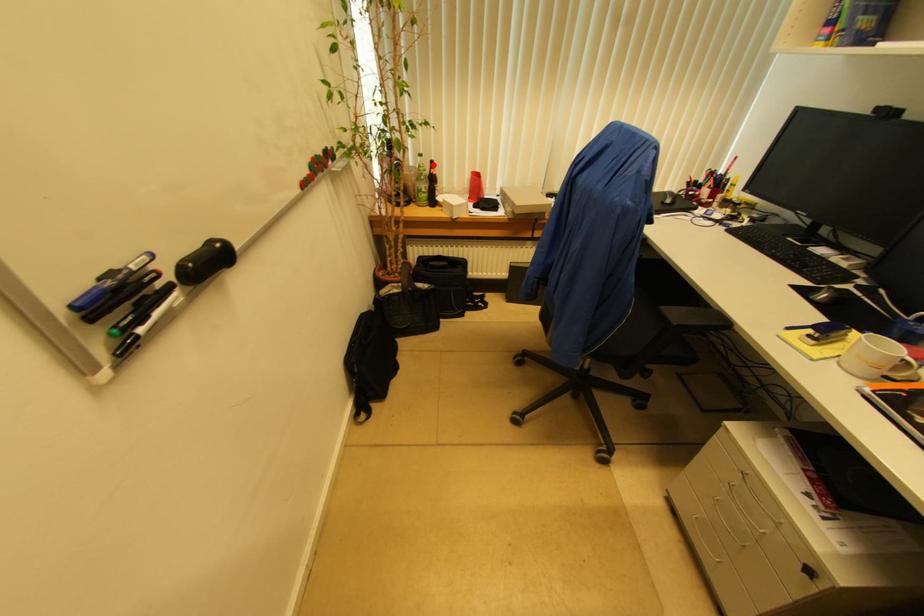
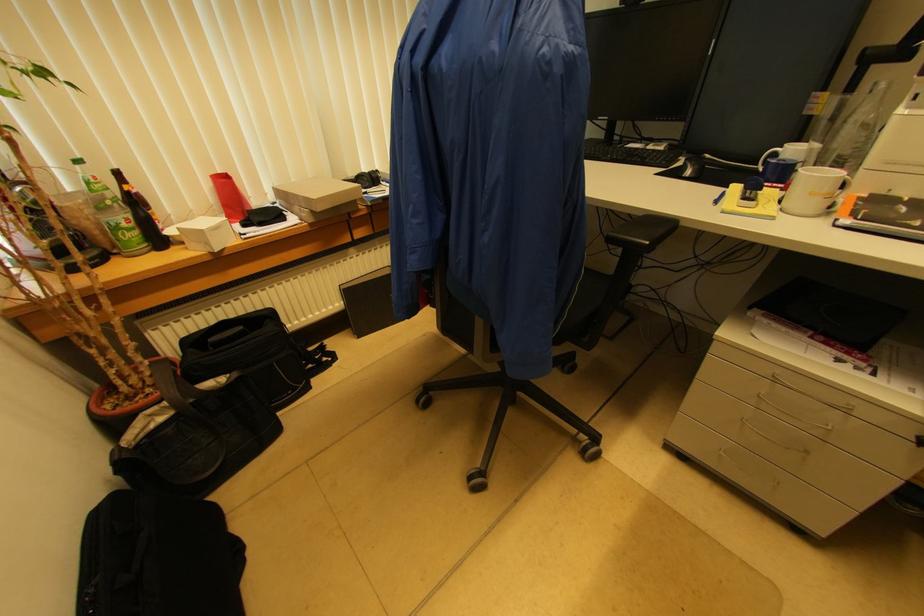
Question: I am providing you with two images of the same scene from different viewpoints. In image1, a red point is highlighted. Considering the same 3D point in image2, which of the following is correct?

Choices:
 (A) It is closer
 (B) It is farther

Answer: (B)